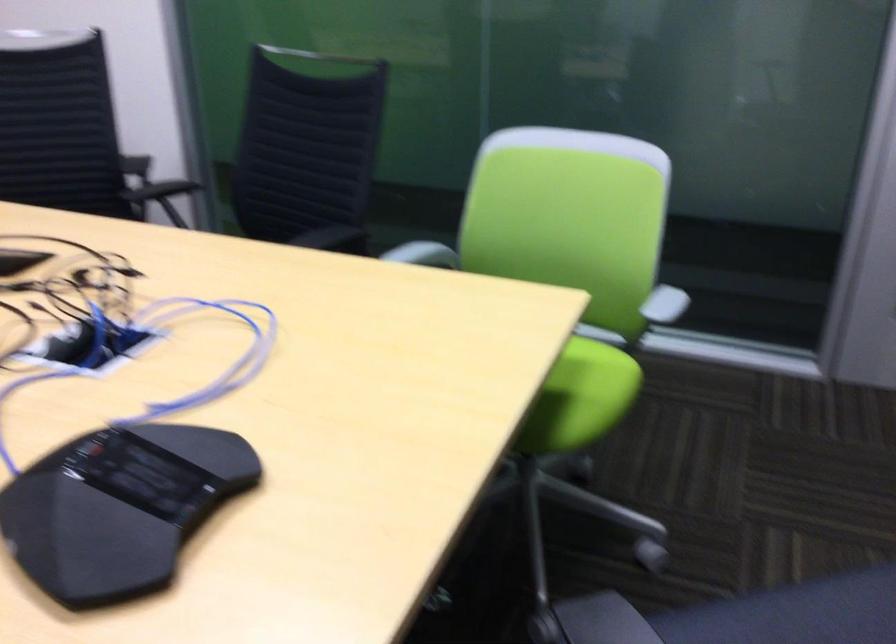
The image size is (896, 644). I want to click on black chair armrest, so click(159, 198).